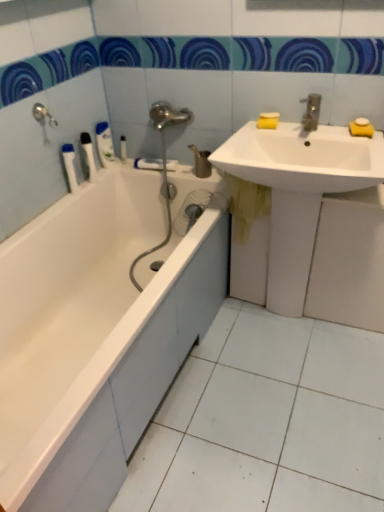
Image resolution: width=384 pixels, height=512 pixels. I want to click on unoccupied area in front of white plastic tube at upper left, which is counted as the fourth toiletry, starting from the left, so click(128, 170).